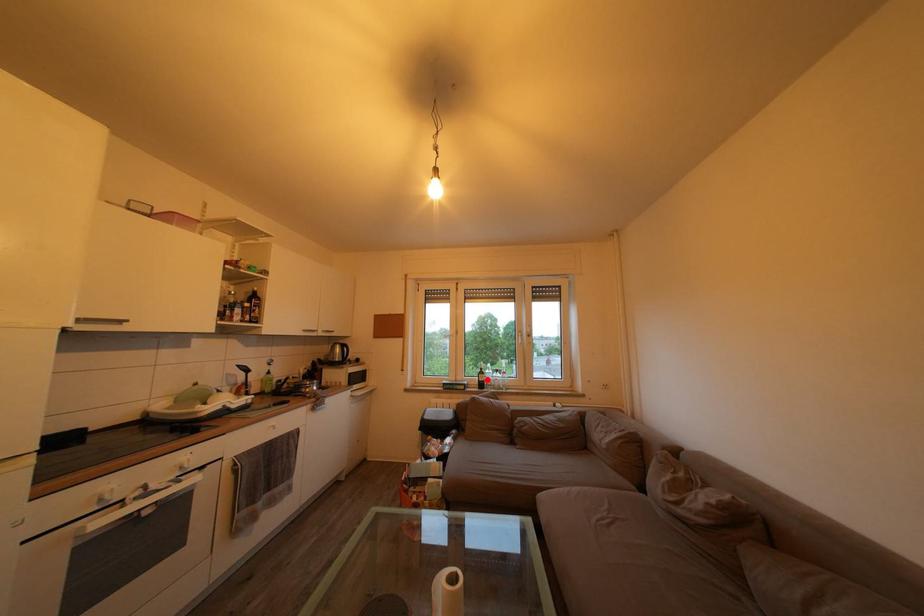
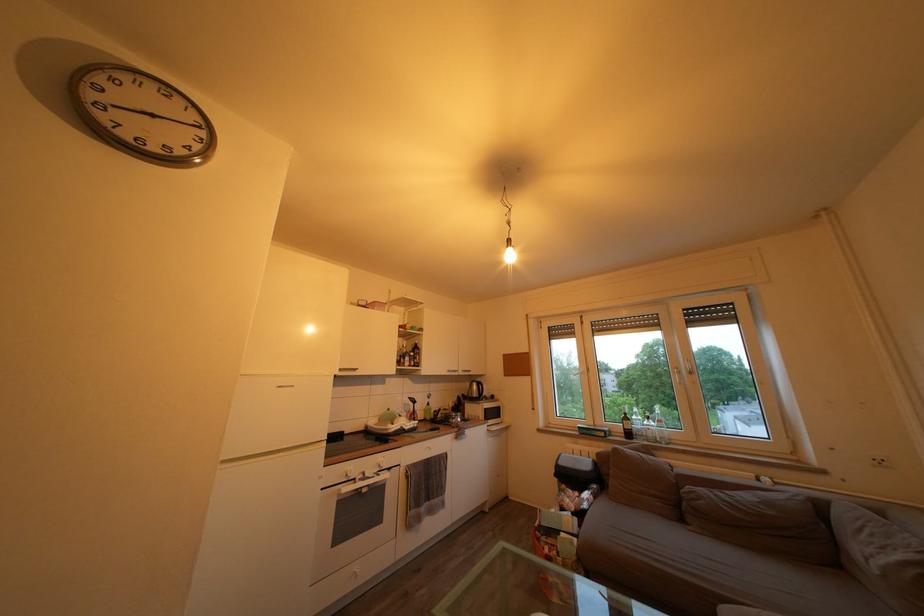
The point at the highlighted location is marked in the first image. Where is the corresponding point in the second image?

(630, 426)